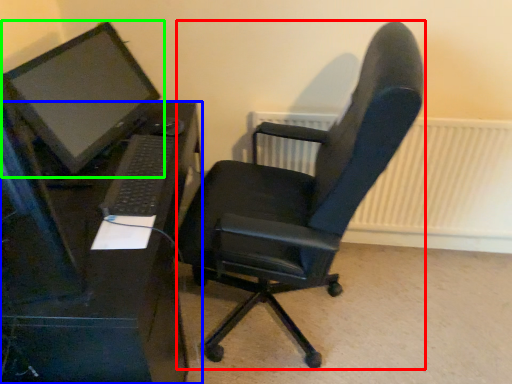
Question: Based on their relative distances, which object is farther from computer chair (highlighted by a red box)? Choose from desk (highlighted by a blue box) and computer monitor (highlighted by a green box).

Choices:
 (A) desk
 (B) computer monitor

Answer: (B)